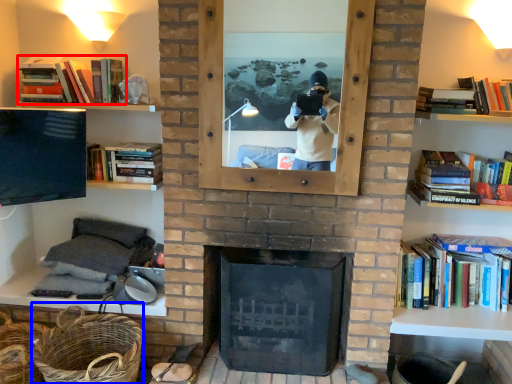
Question: Which object is closer to the camera taking this photo, book (highlighted by a red box) or basket (highlighted by a blue box)?

Choices:
 (A) book
 (B) basket

Answer: (B)